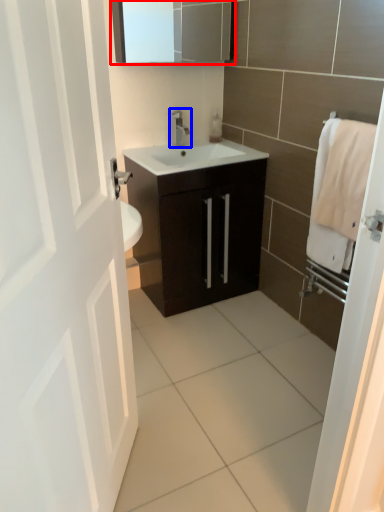
Question: Among these objects, which one is nearest to the camera, medicine cabinet (highlighted by a red box) or tap (highlighted by a blue box)?

Choices:
 (A) medicine cabinet
 (B) tap

Answer: (A)